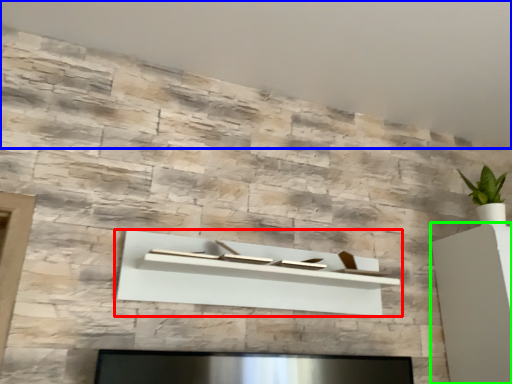
Question: Which object is positioned farthest from shelf (highlighted by a red box)? Select from backdrop (highlighted by a blue box) and furniture (highlighted by a green box).

Choices:
 (A) backdrop
 (B) furniture

Answer: (A)